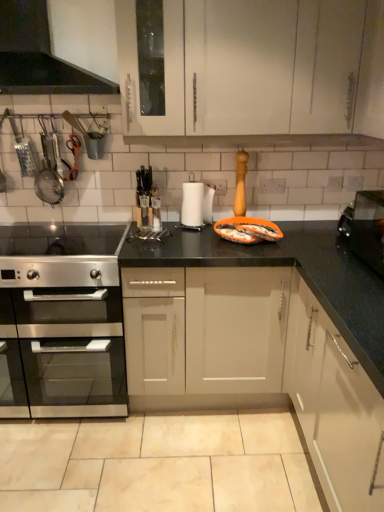
You are a GUI agent. You are given a task and a screenshot of the screen. Output one action in this format:
    pyautogui.click(x=<x>, y=<y>)
    Task: Click on the free point in front of stainless steel oven at left
    The width and height of the screenshot is (384, 512).
    Given the screenshot: What is the action you would take?
    pyautogui.click(x=64, y=463)